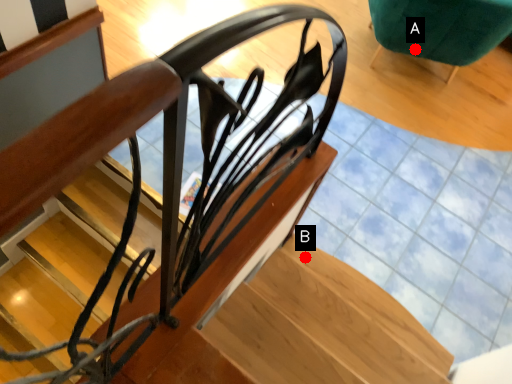
Question: Two points are circled on the image, labeled by A and B beside each circle. Which point is closer to the camera?

Choices:
 (A) A is closer
 (B) B is closer

Answer: (B)